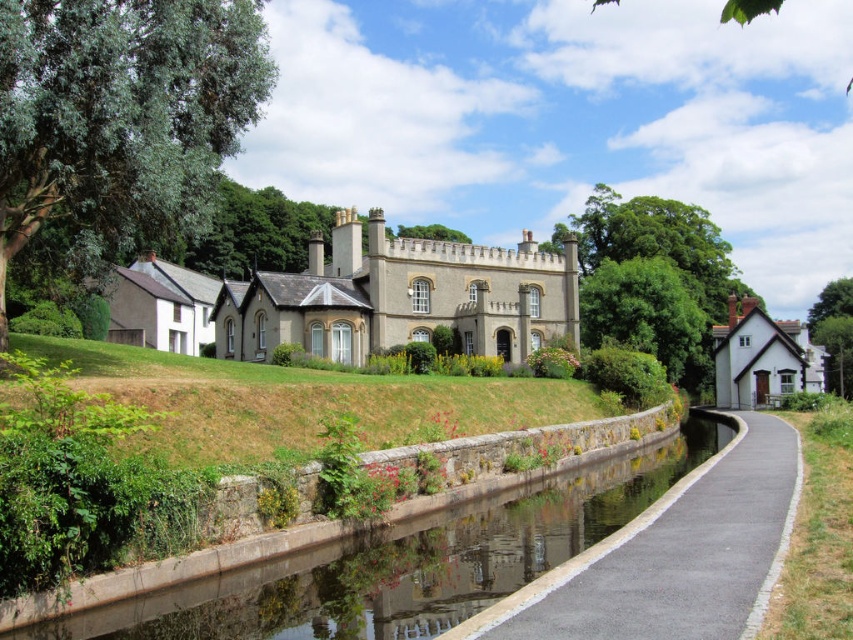
Question: Which object appears closest to the camera in this image?

Choices:
 (A) gray stone castle at center
 (B) smooth concrete canal at center

Answer: (B)

Question: Is black asphalt path at center positioned at the back of gray stone castle at center?

Choices:
 (A) yes
 (B) no

Answer: (B)

Question: Which object is the closest to the gray stone castle at center?

Choices:
 (A) black asphalt path at center
 (B) smooth concrete canal at center

Answer: (B)

Question: Based on their relative distances, which object is nearer to the gray stone castle at center?

Choices:
 (A) black asphalt path at center
 (B) smooth concrete canal at center

Answer: (B)

Question: Is smooth concrete canal at center smaller than black asphalt path at center?

Choices:
 (A) yes
 (B) no

Answer: (A)

Question: Does black asphalt path at center have a lesser width compared to gray stone castle at center?

Choices:
 (A) no
 (B) yes

Answer: (B)